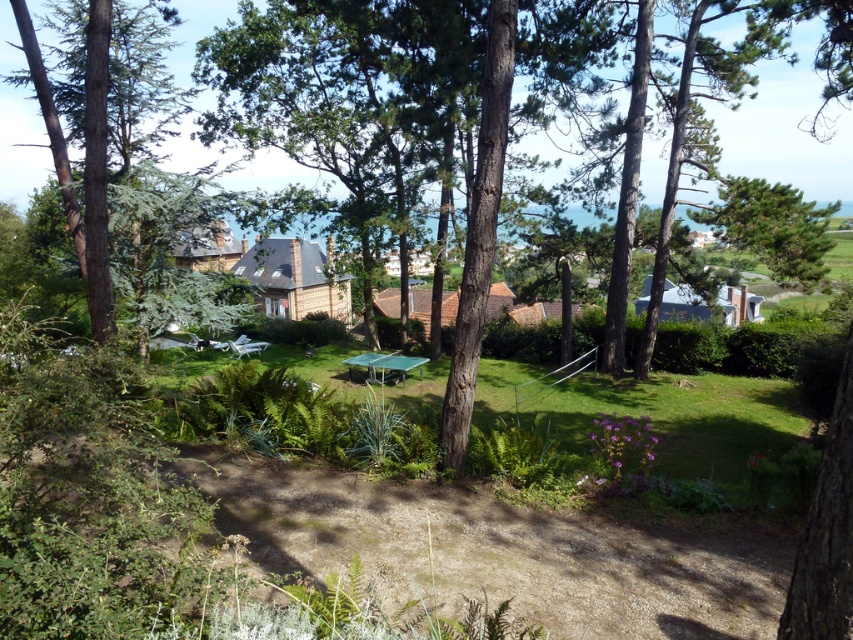
What do you see at coordinates (643, 440) in the screenshot? The height and width of the screenshot is (640, 853). I see `green grass at center` at bounding box center [643, 440].

Does green grass at center have a greater width compared to green metallic picnic table at center?

Correct, the width of green grass at center exceeds that of green metallic picnic table at center.

Which is behind, point (495, 401) or point (419, 374)?

Point (419, 374)

Where is `green grass at center`? Image resolution: width=853 pixels, height=640 pixels. green grass at center is located at coordinates (643, 440).

Who is more forward, (x=784, y=193) or (x=404, y=371)?

Point (x=784, y=193) is in front.

Does green textured pine tree at upper right have a larger size compared to green metallic picnic table at center?

Correct, green textured pine tree at upper right is larger in size than green metallic picnic table at center.

At what (x,y) coordinates should I click in order to perform the action: click on green textured pine tree at upper right. Please return your answer as a coordinate pair (x, y). The height and width of the screenshot is (640, 853). Looking at the image, I should click on (772, 227).

Does green grass at center have a greater height compared to green textured pine tree at upper right?

In fact, green grass at center may be shorter than green textured pine tree at upper right.

Image resolution: width=853 pixels, height=640 pixels. What do you see at coordinates (643, 440) in the screenshot?
I see `green grass at center` at bounding box center [643, 440].

Locate an element on the screen. The height and width of the screenshot is (640, 853). green grass at center is located at coordinates (643, 440).